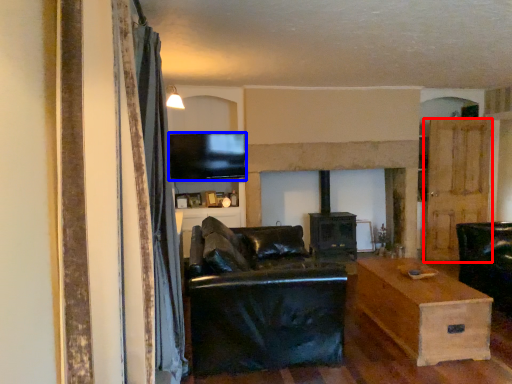
Question: Among these objects, which one is nearest to the camera, door (highlighted by a red box) or television (highlighted by a blue box)?

Choices:
 (A) door
 (B) television

Answer: (B)